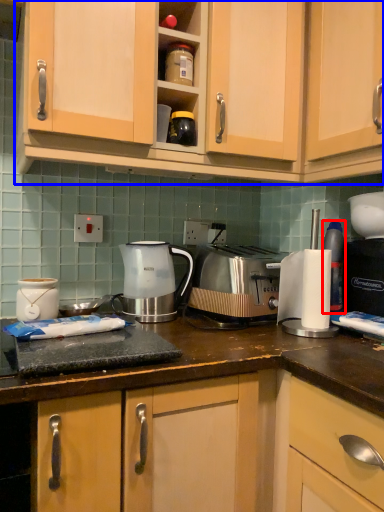
Question: Which point is further to the camera, bottle (highlighted by a red box) or cabinetry (highlighted by a blue box)?

Choices:
 (A) bottle
 (B) cabinetry

Answer: (A)